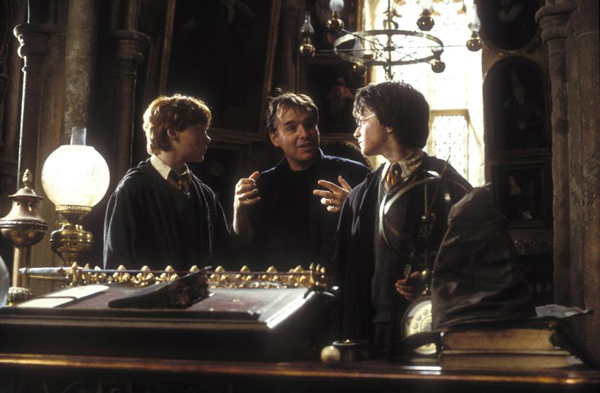
I want to click on window, so click(x=451, y=98).